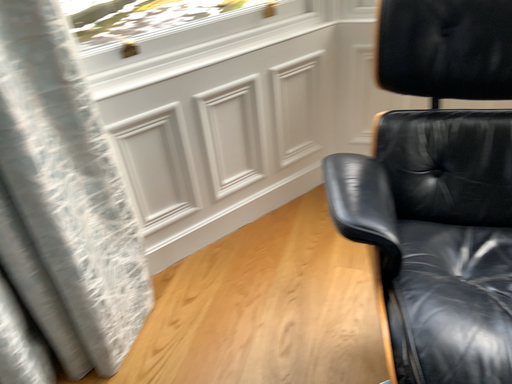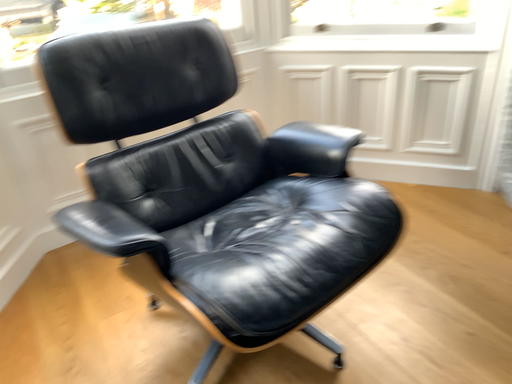
Question: How did the camera likely rotate when shooting the video?

Choices:
 (A) rotated upward
 (B) rotated downward

Answer: (A)